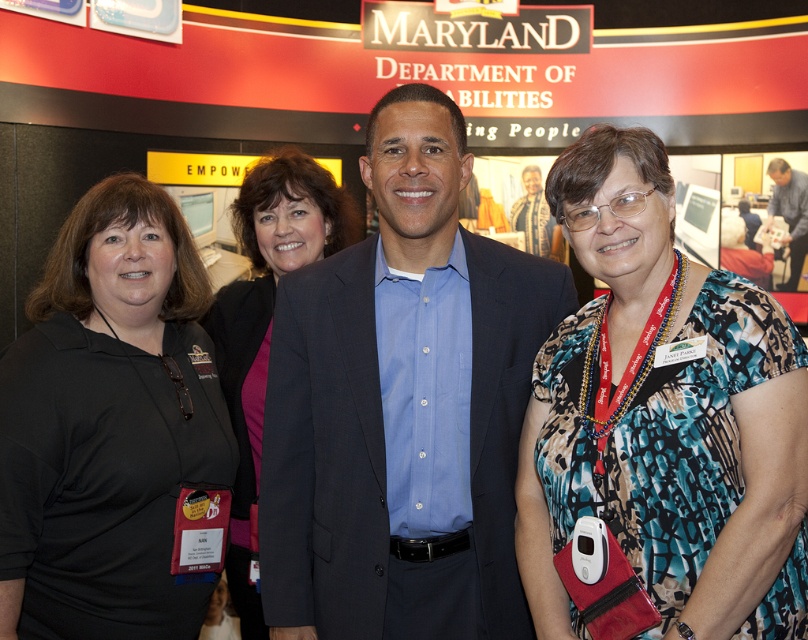
Who is positioned more to the left, blue cotton shirt at center or printed fabric blouse at center?

blue cotton shirt at center

Which is above, blue cotton shirt at center or printed fabric blouse at center?

blue cotton shirt at center

Between point (489, 436) and point (609, 189), which one is positioned in front?

Point (609, 189) is in front.

Find the location of `blue cotton shirt at center`. blue cotton shirt at center is located at coordinates (402, 404).

Can you confirm if blue cotton shirt at center is positioned below black matte shirt at left?

Correct, blue cotton shirt at center is located below black matte shirt at left.

Who is shorter, blue cotton shirt at center or black matte shirt at left?

black matte shirt at left

Which is behind, point (396, 140) or point (186, 312)?

Point (186, 312)

Image resolution: width=808 pixels, height=640 pixels. In order to click on blue cotton shirt at center in this screenshot , I will do `click(402, 404)`.

Between point (629, 438) and point (787, 184), which one is positioned in front?

Point (629, 438) is more forward.

Is printed fabric blouse at center shorter than blue shirt at center?

Yes.

The width and height of the screenshot is (808, 640). I want to click on printed fabric blouse at center, so click(663, 417).